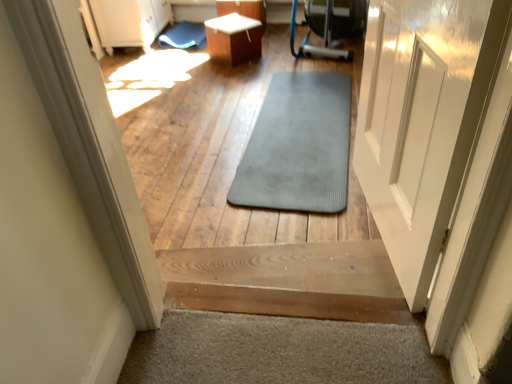
In order to click on vacant space situated above gray rubber mat at center, which ranks as the 1th mat in right-to-left order (from a real-world perspective) in this screenshot , I will do `click(295, 136)`.